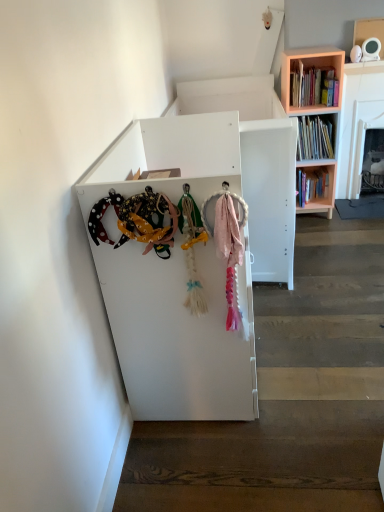
Question: Is hardcover books at upper right next to pink wooden bookcase at upper right?

Choices:
 (A) yes
 (B) no

Answer: (A)

Question: Considering the relative sizes of hardcover books at upper right and pink wooden bookcase at upper right in the image provided, is hardcover books at upper right taller than pink wooden bookcase at upper right?

Choices:
 (A) yes
 (B) no

Answer: (B)

Question: Does hardcover books at upper right have a lesser height compared to pink wooden bookcase at upper right?

Choices:
 (A) no
 (B) yes

Answer: (B)

Question: Considering the relative sizes of hardcover books at upper right and pink wooden bookcase at upper right in the image provided, is hardcover books at upper right wider than pink wooden bookcase at upper right?

Choices:
 (A) no
 (B) yes

Answer: (A)

Question: Would you say pink wooden bookcase at upper right is part of hardcover books at upper right's contents?

Choices:
 (A) yes
 (B) no

Answer: (B)

Question: From a real-world perspective, is pink fabric at lower right positioned above or below pink wooden bookcase at upper right?

Choices:
 (A) above
 (B) below

Answer: (B)

Question: Considering the positions of point tap(324, 355) and point tap(288, 111), is point tap(324, 355) closer or farther from the camera than point tap(288, 111)?

Choices:
 (A) farther
 (B) closer

Answer: (B)

Question: Choose the correct answer: Is pink fabric at lower right inside pink wooden bookcase at upper right or outside it?

Choices:
 (A) outside
 (B) inside

Answer: (A)

Question: Is pink fabric at lower right wider or thinner than pink wooden bookcase at upper right?

Choices:
 (A) wide
 (B) thin

Answer: (A)

Question: Is pink wooden bookcase at upper right wider or thinner than pink fabric at lower right?

Choices:
 (A) wide
 (B) thin

Answer: (B)

Question: In the image, is pink wooden bookcase at upper right positioned in front of or behind pink fabric at lower right?

Choices:
 (A) behind
 (B) front

Answer: (A)

Question: Is pink wooden bookcase at upper right taller or shorter than pink fabric at lower right?

Choices:
 (A) short
 (B) tall

Answer: (B)

Question: Is pink wooden bookcase at upper right bigger or smaller than pink fabric at lower right?

Choices:
 (A) small
 (B) big

Answer: (B)

Question: From the image's perspective, is pink wooden bookcase at upper right located above or below hardcover books at upper right?

Choices:
 (A) below
 (B) above

Answer: (A)

Question: From their relative heights in the image, would you say pink wooden bookcase at upper right is taller or shorter than hardcover books at upper right?

Choices:
 (A) short
 (B) tall

Answer: (B)